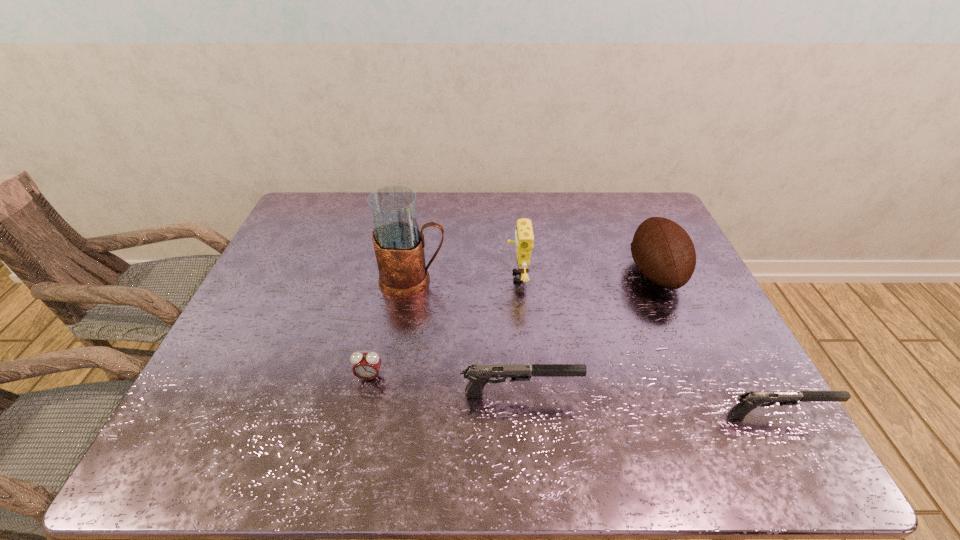
Given the evenly spaced guns in the image, where should an extra gun be added on the left to preserve the spacing? Please point to a vacant space. Please provide its 2D coordinates. Your answer should be formatted as a tuple, i.e. [(x, y)], where the tuple contains the x and y coordinates of a point satisfying the conditions above.

[(283, 373)]